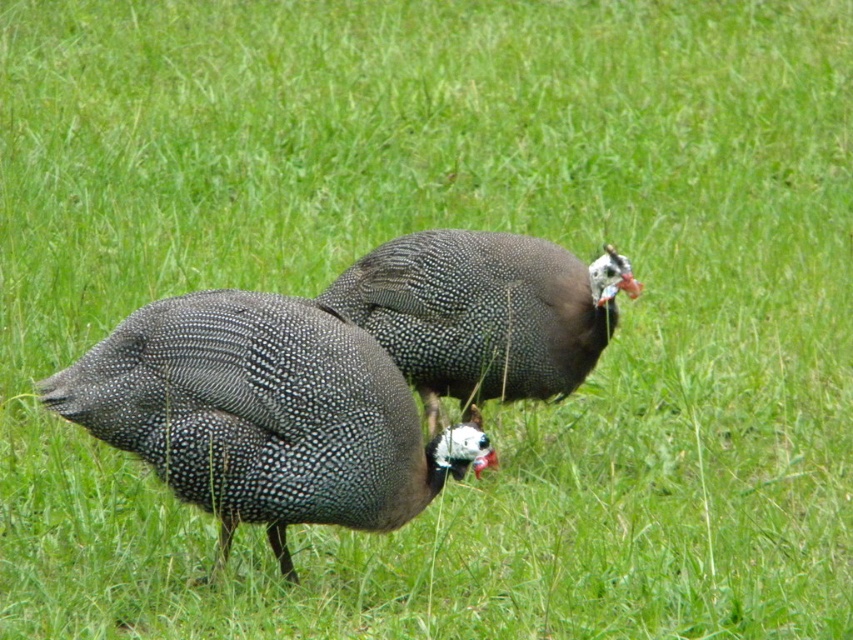
Question: Does speckled feathered turkey at center have a greater width compared to speckled feathered guinea fowl at center?

Choices:
 (A) yes
 (B) no

Answer: (A)

Question: Among these objects, which one is nearest to the camera?

Choices:
 (A) speckled feathered guinea fowl at center
 (B) speckled feathered turkey at center

Answer: (B)

Question: Is speckled feathered turkey at center wider than speckled feathered guinea fowl at center?

Choices:
 (A) yes
 (B) no

Answer: (A)

Question: Which object is closer to the camera taking this photo?

Choices:
 (A) speckled feathered guinea fowl at center
 (B) speckled feathered turkey at center

Answer: (B)

Question: Can you confirm if speckled feathered turkey at center is smaller than speckled feathered guinea fowl at center?

Choices:
 (A) no
 (B) yes

Answer: (B)